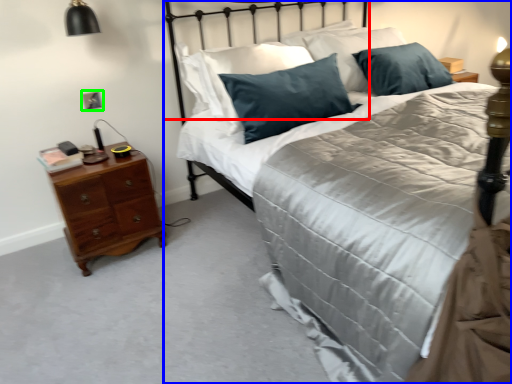
Question: Which is nearer to the headboard (highlighted by a red box)? bed (highlighted by a blue box) or electric outlet (highlighted by a green box).

Choices:
 (A) bed
 (B) electric outlet

Answer: (B)